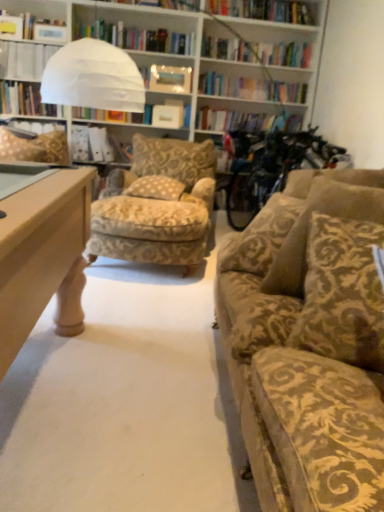
Question: Is beige damask pillow at center, the 2th pillow when ordered from left to right, outside brown textured pillow at right, which is the 1th pillow from front to back?

Choices:
 (A) no
 (B) yes

Answer: (B)

Question: Is beige damask pillow at center, the 2th pillow when ordered from left to right, positioned far away from brown textured pillow at right, which is counted as the third pillow, starting from the left?

Choices:
 (A) no
 (B) yes

Answer: (B)

Question: Considering the relative positions of beige damask pillow at center, the 2th pillow viewed from the back, and brown textured pillow at right, placed as the 4th pillow when sorted from back to front, in the image provided, is beige damask pillow at center, the 2th pillow viewed from the back, to the right of brown textured pillow at right, placed as the 4th pillow when sorted from back to front, from the viewer's perspective?

Choices:
 (A) yes
 (B) no

Answer: (B)

Question: Can you confirm if beige damask pillow at center, which is the 3th pillow in right-to-left order, is taller than brown textured pillow at right, placed as the 4th pillow when sorted from back to front?

Choices:
 (A) yes
 (B) no

Answer: (B)

Question: Considering the relative sizes of beige damask pillow at center, the 2th pillow viewed from the back, and brown textured pillow at right, which is counted as the third pillow, starting from the left, in the image provided, is beige damask pillow at center, the 2th pillow viewed from the back, wider than brown textured pillow at right, which is counted as the third pillow, starting from the left,?

Choices:
 (A) yes
 (B) no

Answer: (B)

Question: From the image's perspective, is gold damask pillow at left, the fourth pillow viewed from the right, positioned above or below velvet gold-patterned couch at right?

Choices:
 (A) above
 (B) below

Answer: (A)

Question: Is gold damask pillow at left, the fourth pillow viewed from the right, to the left or to the right of velvet gold-patterned couch at right in the image?

Choices:
 (A) left
 (B) right

Answer: (A)

Question: Considering the positions of gold damask pillow at left, arranged as the fourth pillow when viewed from the front, and velvet gold-patterned couch at right in the image, is gold damask pillow at left, arranged as the fourth pillow when viewed from the front, bigger or smaller than velvet gold-patterned couch at right?

Choices:
 (A) big
 (B) small

Answer: (B)

Question: Considering their positions, is gold damask pillow at left, which ranks as the first pillow in back-to-front order, located in front of or behind velvet gold-patterned couch at right?

Choices:
 (A) behind
 (B) front

Answer: (A)

Question: From a real-world perspective, is brown textured pillow at right, marked as the 2th pillow in a right-to-left arrangement, physically located above or below beige damask pillow at center, the 2th pillow when ordered from left to right?

Choices:
 (A) above
 (B) below

Answer: (A)

Question: In the image, is brown textured pillow at right, which is the 1th pillow from front to back, on the left side or the right side of beige damask pillow at center, the 2th pillow when ordered from left to right?

Choices:
 (A) right
 (B) left

Answer: (A)

Question: Considering the positions of brown textured pillow at right, marked as the 2th pillow in a right-to-left arrangement, and beige damask pillow at center, which is the 3th pillow in right-to-left order, in the image, is brown textured pillow at right, marked as the 2th pillow in a right-to-left arrangement, taller or shorter than beige damask pillow at center, which is the 3th pillow in right-to-left order,?

Choices:
 (A) short
 (B) tall

Answer: (B)

Question: Looking at their shapes, would you say brown textured pillow at right, which is the 1th pillow from front to back, is wider or thinner than beige damask pillow at center, the 2th pillow when ordered from left to right?

Choices:
 (A) wide
 (B) thin

Answer: (A)

Question: From the image's perspective, is beige damask pillow at center, the 2th pillow when ordered from left to right, located above or below gold-patterned fabric chair at center?

Choices:
 (A) below
 (B) above

Answer: (B)

Question: Looking at the image, does beige damask pillow at center, the 2th pillow viewed from the back, seem bigger or smaller compared to gold-patterned fabric chair at center?

Choices:
 (A) small
 (B) big

Answer: (A)